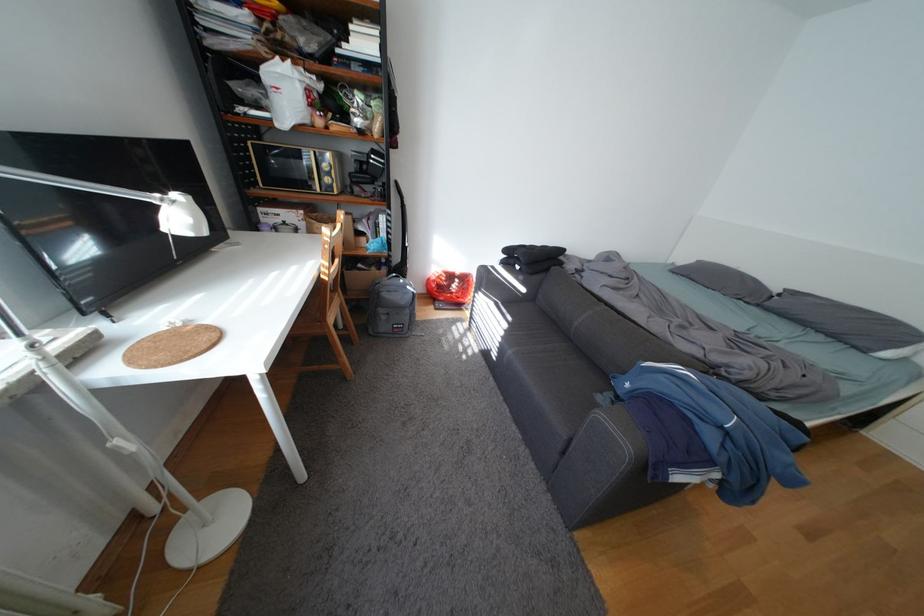
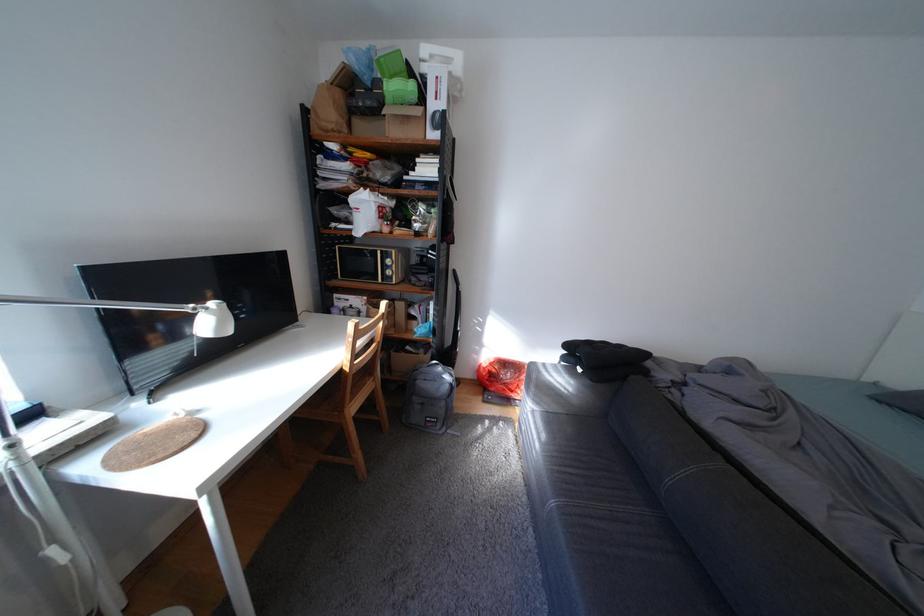
The point at (189, 197) is marked in the first image. Where is the corresponding point in the second image?

(225, 305)